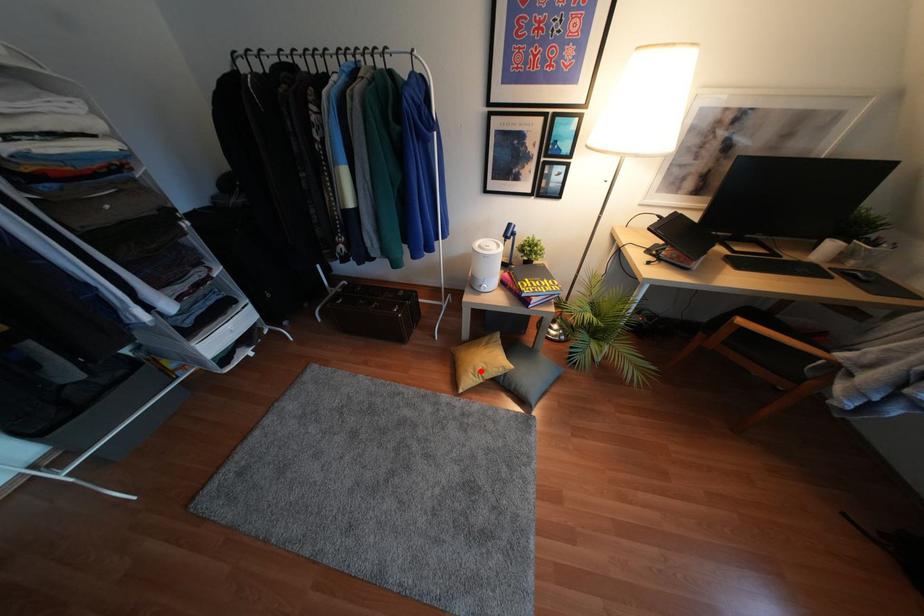
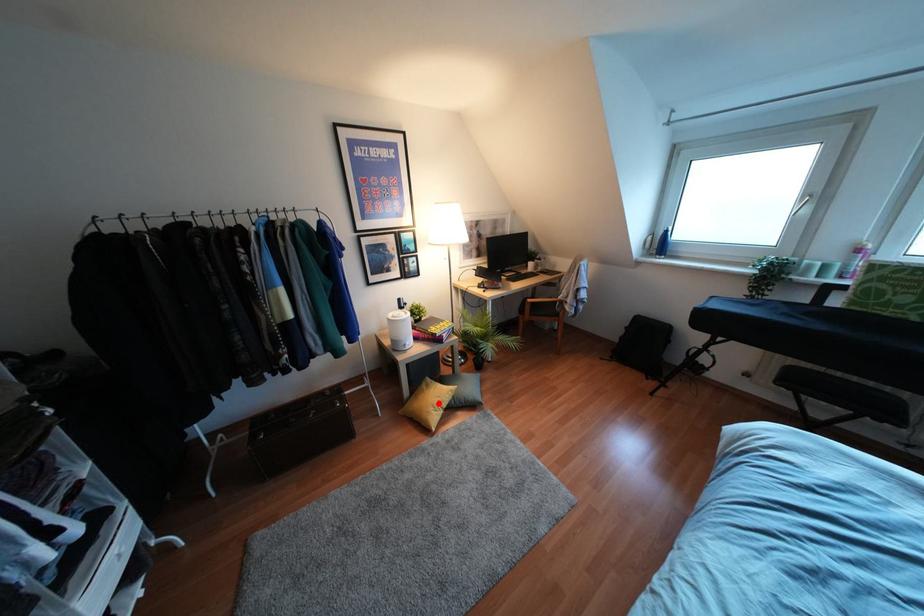
I am providing you with two images of the same scene from different viewpoints. A red point is marked on the first image and another point is marked on the second image. Is the red point in image1 aligned with the point shown in image2?

Yes